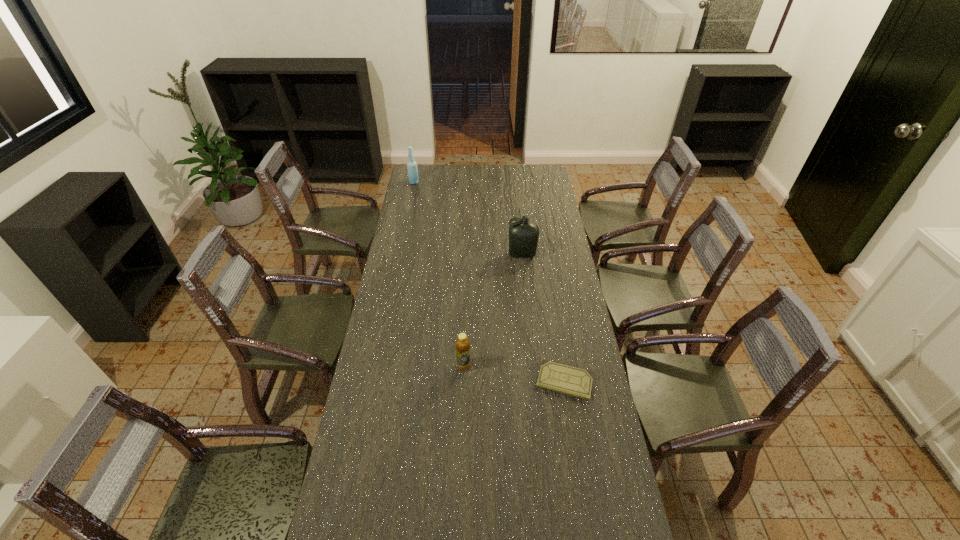
Find the location of a particular element. The image size is (960, 540). free space located on the left of the checkbook is located at coordinates (472, 381).

Locate an element on the screen. This screenshot has width=960, height=540. object that is at the far edge is located at coordinates (411, 164).

This screenshot has width=960, height=540. I want to click on object that is at the left edge, so click(x=411, y=164).

Find the location of a particular element. This screenshot has width=960, height=540. bottle that is at the right edge is located at coordinates (523, 235).

Identify the location of checkbook that is positioned at the right edge. The height and width of the screenshot is (540, 960). (556, 377).

Where is `object at the far left corner`? Image resolution: width=960 pixels, height=540 pixels. object at the far left corner is located at coordinates (411, 164).

Find the location of a particular element. vacant space at the far edge of the desktop is located at coordinates (507, 172).

In the image, there is a desktop. Identify the location of free space at the left edge. (370, 521).

This screenshot has width=960, height=540. What are the coordinates of `vacant space at the right edge` in the screenshot? It's located at (580, 405).

In order to click on vacant space at the far right corner of the desktop in this screenshot , I will do `click(534, 175)`.